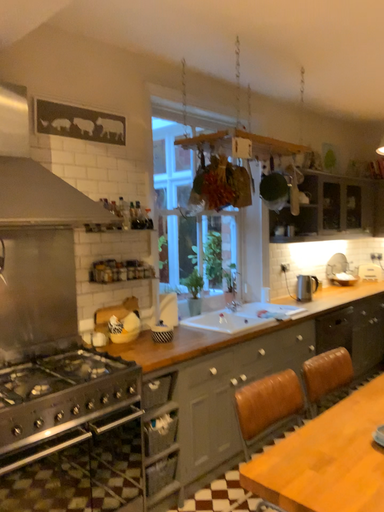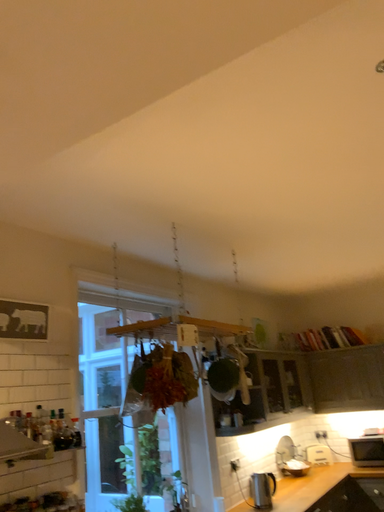
Question: How did the camera likely rotate when shooting the video?

Choices:
 (A) rotated upward
 (B) rotated downward

Answer: (A)